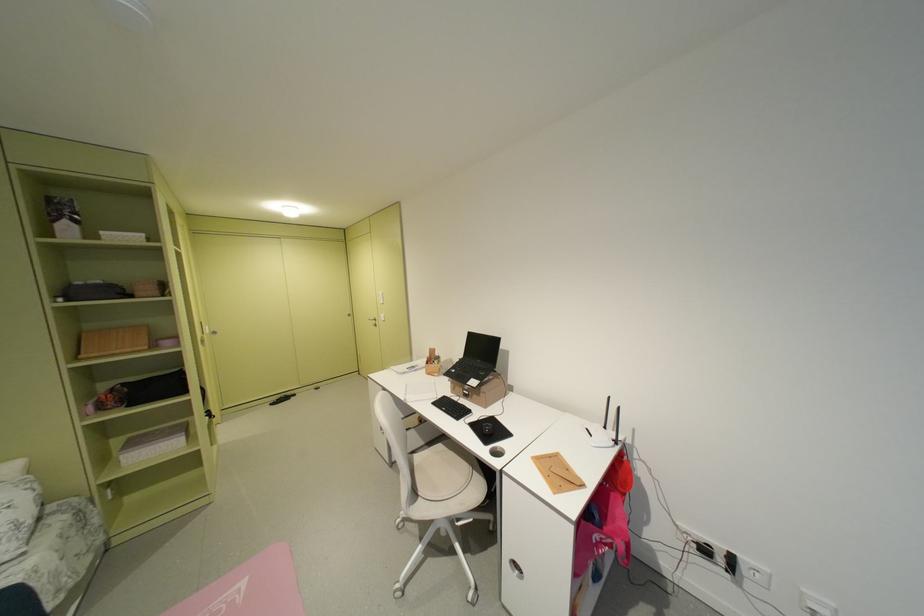
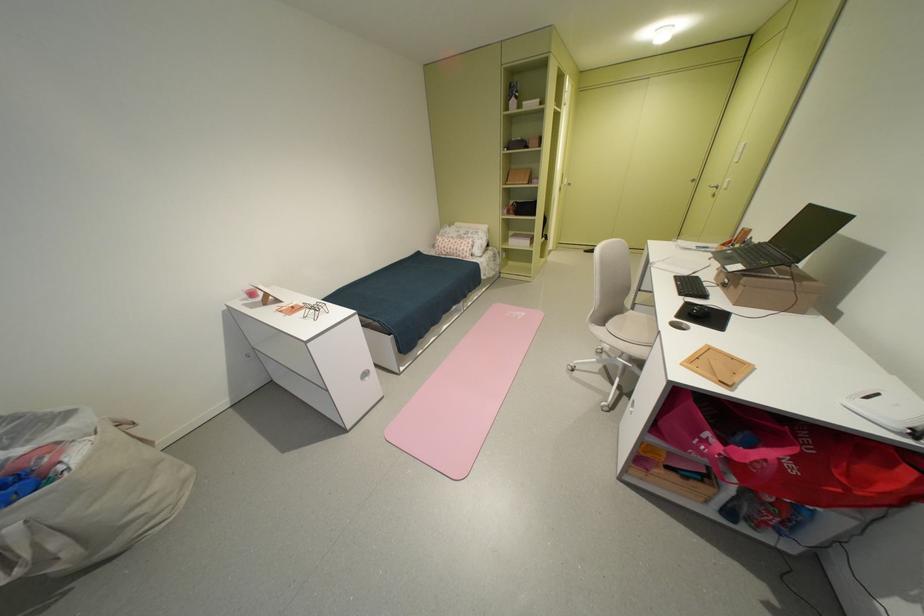
The point at (429, 495) is marked in the first image. Where is the corresponding point in the second image?

(615, 326)